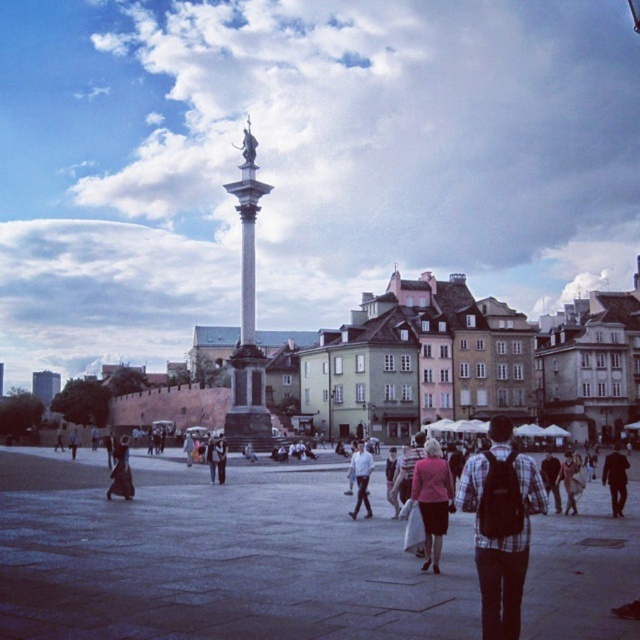
Question: Considering the real-world distances, which object is closest to the dark brown leather jacket at lower right?

Choices:
 (A) plaid shirt at center
 (B) matte pink blazer at center
 (C) light brown leather jacket at lower right

Answer: (A)

Question: Is matte pink blazer at center above light brown leather jacket at lower right?

Choices:
 (A) yes
 (B) no

Answer: (A)

Question: Does dark brown leather coat at lower left appear under light brown leather jacket at lower right?

Choices:
 (A) no
 (B) yes

Answer: (B)

Question: Is plaid fabric shirt at center further to camera compared to dark brown leather coat at lower left?

Choices:
 (A) no
 (B) yes

Answer: (A)

Question: Which point is farther to the camera?

Choices:
 (A) plaid fabric shirt at center
 (B) matte pink blazer at center
 (C) polished stone column at center

Answer: (C)

Question: Which of the following is the farthest from the observer?

Choices:
 (A) polished stone column at center
 (B) plaid fabric shirt at center

Answer: (A)